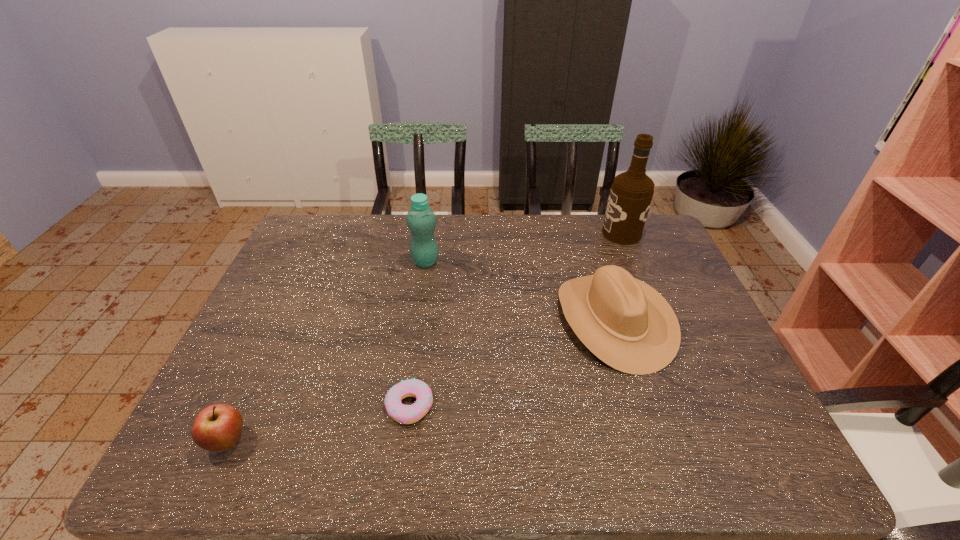
Locate an element on the screen. vacant point located on the label of the tallest object is located at coordinates (576, 233).

Locate an element on the screen. blank space located on the label of the tallest object is located at coordinates point(562,233).

Find the location of a particular element. The height and width of the screenshot is (540, 960). blank space located at the front cap of the second farthest object is located at coordinates (417, 320).

Locate an element on the screen. free space located on the right of the cowboy hat is located at coordinates (706, 320).

Image resolution: width=960 pixels, height=540 pixels. In order to click on blank space located on the back of the leftmost object in this screenshot , I will do `click(251, 391)`.

Find the location of a particular element. The width and height of the screenshot is (960, 540). vacant space located on the right of the doughnut is located at coordinates (596, 406).

Locate an element on the screen. The height and width of the screenshot is (540, 960). alcohol that is at the far edge is located at coordinates (631, 193).

The height and width of the screenshot is (540, 960). I want to click on water bottle situated at the far edge, so pos(421,220).

The image size is (960, 540). I want to click on object that is at the near edge, so click(x=218, y=427).

This screenshot has height=540, width=960. Find the location of `object that is at the left edge`. object that is at the left edge is located at coordinates (218, 427).